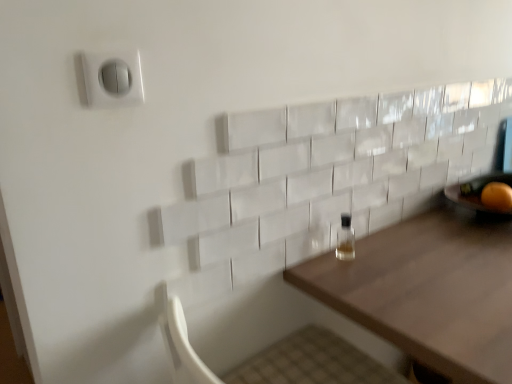
Question: Considering the positions of point (487, 322) and point (347, 226), is point (487, 322) closer or farther from the camera than point (347, 226)?

Choices:
 (A) closer
 (B) farther

Answer: (A)

Question: Is wooden table at center to the left or to the right of clear glass bottle at center in the image?

Choices:
 (A) right
 (B) left

Answer: (A)

Question: Estimate the real-world distances between objects in this image. Which object is farther from the wooden table at center?

Choices:
 (A) clear glass bottle at center
 (B) white plastic switch at upper left
 (C) orange matte at right

Answer: (B)

Question: Estimate the real-world distances between objects in this image. Which object is closer to the clear glass bottle at center?

Choices:
 (A) wooden table at center
 (B) white plastic switch at upper left
 (C) orange matte at right

Answer: (A)